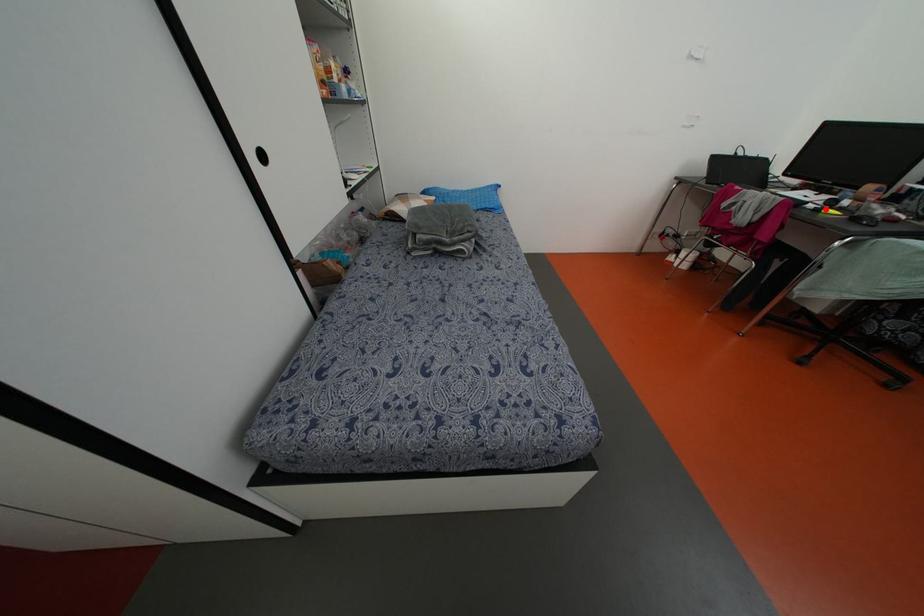
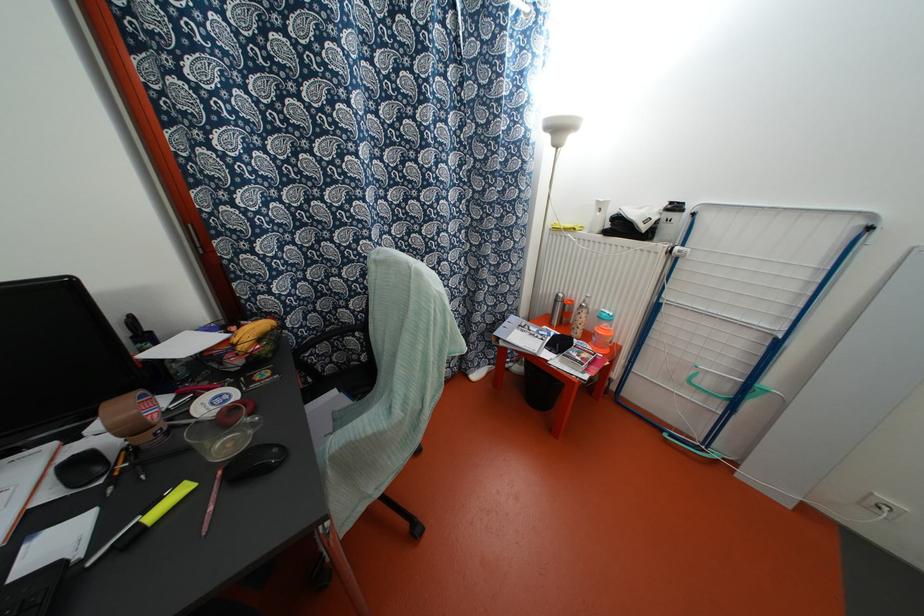
The point at the highlighted location is marked in the first image. Where is the corresponding point in the second image?

(152, 515)